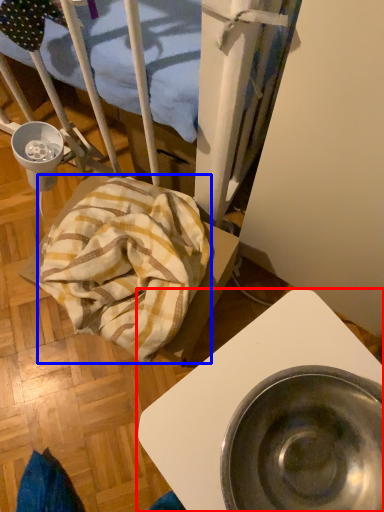
Question: Which object is closer to the camera taking this photo, furniture (highlighted by a red box) or blanket (highlighted by a blue box)?

Choices:
 (A) furniture
 (B) blanket

Answer: (A)